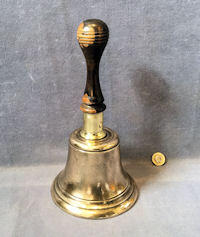
Locate an element on the screen. The height and width of the screenshot is (237, 200). area where wall meets floor is located at coordinates (34, 166).